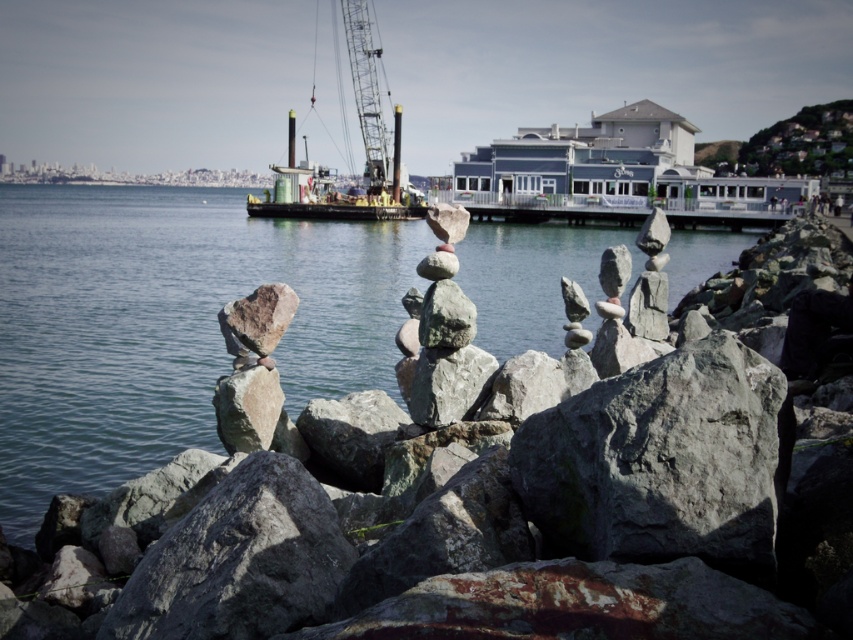
You are a construction worker who needs to determine which crane has more space available for additional equipment. Based on the scene, which crane between the metallic yellow crane at upper center and the metallic gray crane at center would allow for more equipment storage?

The metallic gray crane at center occupies more space than the metallic yellow crane at upper center, so the metallic gray crane at center has more space available for additional equipment storage.

You are a construction supervisor observing the waterfront scene. You need to determine which crane has a shorter height between the metallic yellow crane at upper center and the metallic gray crane at center. Based on the scene, which one is shorter?

The metallic yellow crane at upper center is not as tall as the metallic gray crane at center, so the metallic yellow crane at upper center is shorter.